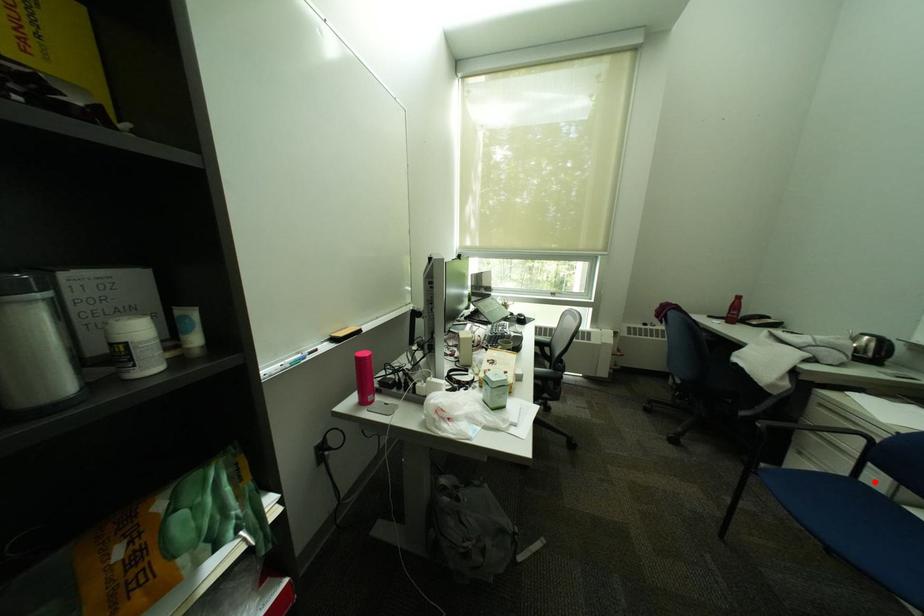
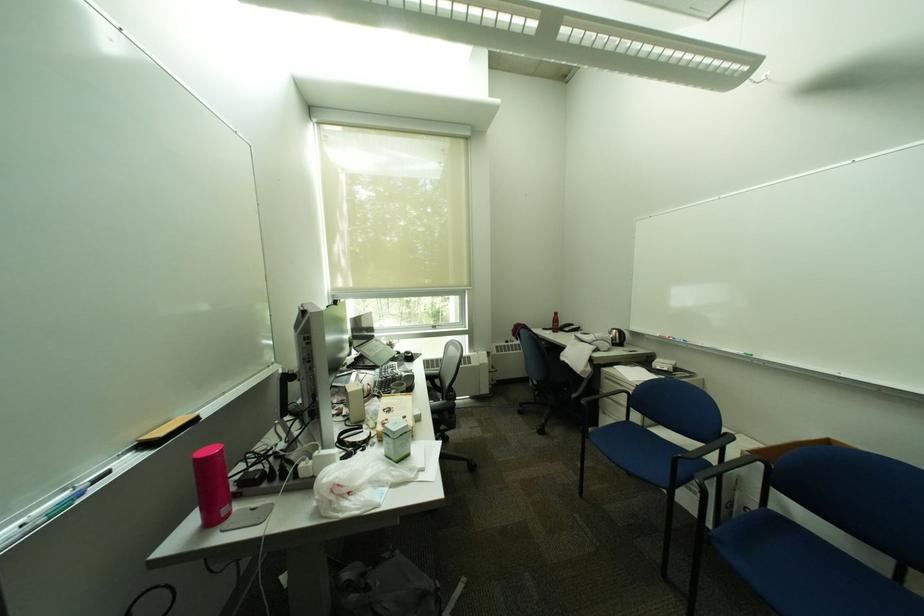
Find the pixel in the second image that matches the highlighted location in the first image.

(641, 421)